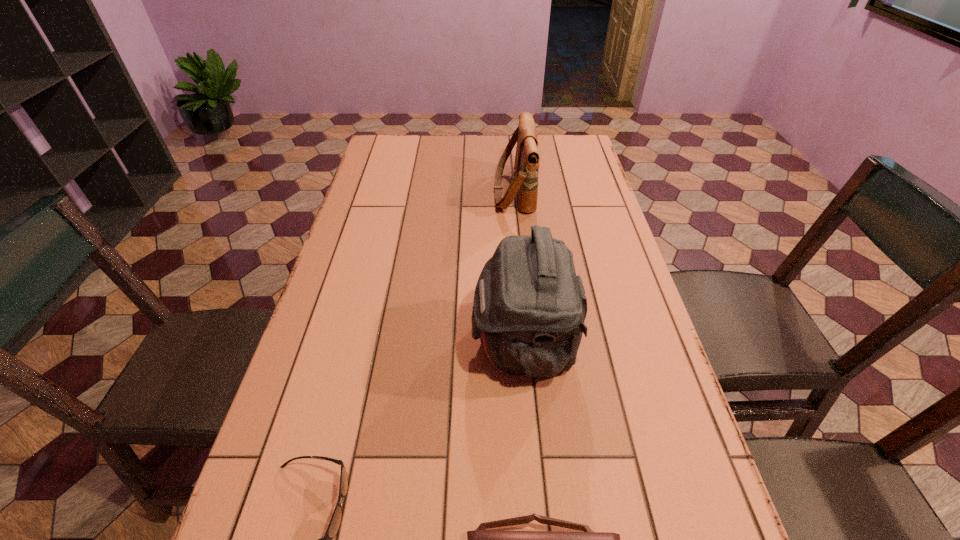
At what (x,y) coordinates should I click in order to perform the action: click on the tallest object. Please return your answer as a coordinate pair (x, y). The image size is (960, 540). Looking at the image, I should click on (529, 308).

Find the location of a particular element. The image size is (960, 540). the second farthest object is located at coordinates (529, 308).

Where is `the farthest shoulder bag`? Image resolution: width=960 pixels, height=540 pixels. the farthest shoulder bag is located at coordinates (525, 183).

I want to click on the second shortest shoulder bag, so click(525, 183).

You are a GUI agent. You are given a task and a screenshot of the screen. Output one action in this format:
    pyautogui.click(x=<x>, y=<y>)
    Task: Click on the vacant region located 0.300m on the open flap of the second farthest object
    This screenshot has width=960, height=540.
    Given the screenshot: What is the action you would take?
    pyautogui.click(x=340, y=343)

I want to click on vacant region located on the open flap of the second farthest object, so click(x=397, y=343).

Where is `free space located 0.270m on the open flap of the second farthest object`? free space located 0.270m on the open flap of the second farthest object is located at coordinates (353, 343).

Identify the location of free location located on the front-facing side of the farthest object. The image size is (960, 540). coord(420,191).

The width and height of the screenshot is (960, 540). I want to click on vacant area located 0.120m on the front-facing side of the farthest object, so click(x=457, y=191).

The height and width of the screenshot is (540, 960). What are the coordinates of `vacant space located on the front-facing side of the farthest object` in the screenshot? It's located at (457, 191).